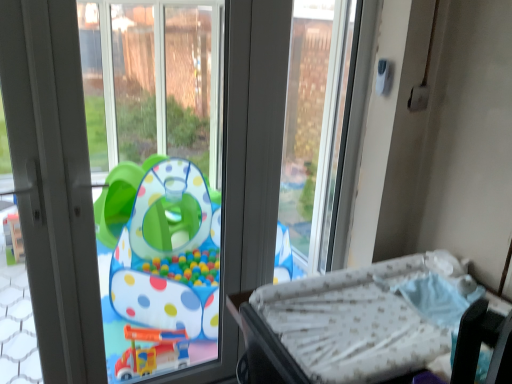
Measure the distance between point (135, 103) and camera.

The distance of point (135, 103) from camera is 4.12 meters.

What do you see at coordinates (49, 171) in the screenshot? I see `white plastic screen door at left` at bounding box center [49, 171].

In order to click on transparent plastic window screen at upper center, which is the second window screen from left to right in this screenshot , I will do `click(314, 123)`.

Which is behind, transparent plastic playpen at center, arranged as the second window screen when viewed from the right, or white plastic screen door at left?

transparent plastic playpen at center, arranged as the second window screen when viewed from the right, is further away from the camera.

Which is closer to the camera, [153,126] or [71,12]?

The point [71,12] is in front.

Is transparent plastic playpen at center, arranged as the second window screen when viewed from the right, far from white plastic screen door at left?

Absolutely, transparent plastic playpen at center, arranged as the second window screen when viewed from the right, is distant from white plastic screen door at left.

Does transparent plastic playpen at center, placed as the 1th window screen when sorted from left to right, have a smaller size compared to white plastic screen door at left?

Incorrect, transparent plastic playpen at center, placed as the 1th window screen when sorted from left to right, is not smaller in size than white plastic screen door at left.

Looking at this image, from the image's perspective, between transparent plastic window screen at upper center, which is the second window screen from left to right, and transparent plastic playpen at center, arranged as the second window screen when viewed from the right, who is located below?

transparent plastic playpen at center, arranged as the second window screen when viewed from the right, from the image's perspective.

Looking at the image, does transparent plastic window screen at upper center, marked as the 1th window screen in a right-to-left arrangement, seem bigger or smaller compared to transparent plastic playpen at center, placed as the 1th window screen when sorted from left to right?

Clearly, transparent plastic window screen at upper center, marked as the 1th window screen in a right-to-left arrangement, is smaller in size than transparent plastic playpen at center, placed as the 1th window screen when sorted from left to right.

Considering their positions, is transparent plastic window screen at upper center, which is the second window screen from left to right, located in front of or behind transparent plastic playpen at center, placed as the 1th window screen when sorted from left to right?

transparent plastic window screen at upper center, which is the second window screen from left to right, is behind transparent plastic playpen at center, placed as the 1th window screen when sorted from left to right.

At what (x,y) coordinates should I click in order to perform the action: click on screen door in front of the transparent plastic playpen at center, arranged as the second window screen when viewed from the right. Please return your answer as a coordinate pair (x, y). Looking at the image, I should click on (49, 171).

Between white plastic screen door at left and transparent plastic playpen at center, placed as the 1th window screen when sorted from left to right, which one is positioned behind?

Positioned behind is transparent plastic playpen at center, placed as the 1th window screen when sorted from left to right.

Which is closer to the camera, (10, 78) or (199, 3)?

Positioned in front is point (10, 78).

From the image's perspective, is white plastic screen door at left below transparent plastic playpen at center, arranged as the second window screen when viewed from the right?

No.

Could you tell me if white dotted mattress at lower right is facing transparent plastic playpen at center, placed as the 1th window screen when sorted from left to right?

No, white dotted mattress at lower right is not aimed at transparent plastic playpen at center, placed as the 1th window screen when sorted from left to right.

Would you say white dotted mattress at lower right is outside transparent plastic playpen at center, placed as the 1th window screen when sorted from left to right?

Yes, white dotted mattress at lower right is located beyond the bounds of transparent plastic playpen at center, placed as the 1th window screen when sorted from left to right.

Can you tell me how much white dotted mattress at lower right and transparent plastic playpen at center, arranged as the second window screen when viewed from the right, differ in facing direction?

white dotted mattress at lower right and transparent plastic playpen at center, arranged as the second window screen when viewed from the right, are facing 88.5 degrees away from each other.

You are a GUI agent. You are given a task and a screenshot of the screen. Output one action in this format:
    pyautogui.click(x=<x>, y=<y>)
    Task: Click on the 1st window screen positioned above the white dotted mattress at lower right (from a real-world perspective)
    Image resolution: width=512 pixels, height=384 pixels.
    Given the screenshot: What is the action you would take?
    pyautogui.click(x=156, y=178)

From the image's perspective, which is above, white plastic screen door at left or transparent plastic window screen at upper center, which is the second window screen from left to right?

transparent plastic window screen at upper center, which is the second window screen from left to right.

Which of these two, white plastic screen door at left or transparent plastic window screen at upper center, marked as the 1th window screen in a right-to-left arrangement, stands taller?

white plastic screen door at left.

Based on the photo, from a real-world perspective, is white plastic screen door at left below transparent plastic window screen at upper center, which is the second window screen from left to right?

Correct, in the physical world, white plastic screen door at left is lower than transparent plastic window screen at upper center, which is the second window screen from left to right.

Is white plastic screen door at left next to transparent plastic window screen at upper center, marked as the 1th window screen in a right-to-left arrangement, and touching it?

No, white plastic screen door at left is not next to transparent plastic window screen at upper center, marked as the 1th window screen in a right-to-left arrangement.

Considering the relative sizes of transparent plastic window screen at upper center, marked as the 1th window screen in a right-to-left arrangement, and white plastic screen door at left in the image provided, is transparent plastic window screen at upper center, marked as the 1th window screen in a right-to-left arrangement, bigger than white plastic screen door at left?

Actually, transparent plastic window screen at upper center, marked as the 1th window screen in a right-to-left arrangement, might be smaller than white plastic screen door at left.

Considering the positions of point (300, 157) and point (29, 155), is point (300, 157) closer or farther from the camera than point (29, 155)?

Point (300, 157) appears to be farther away from the viewer than point (29, 155).

From a real-world perspective, which is physically below, transparent plastic window screen at upper center, which is the second window screen from left to right, or white plastic screen door at left?

white plastic screen door at left.

Is transparent plastic playpen at center, placed as the 1th window screen when sorted from left to right, oriented towards transparent plastic window screen at upper center, marked as the 1th window screen in a right-to-left arrangement?

No, transparent plastic playpen at center, placed as the 1th window screen when sorted from left to right, is not oriented towards transparent plastic window screen at upper center, marked as the 1th window screen in a right-to-left arrangement.

Considering the sizes of objects transparent plastic playpen at center, placed as the 1th window screen when sorted from left to right, and transparent plastic window screen at upper center, marked as the 1th window screen in a right-to-left arrangement, in the image provided, who is smaller, transparent plastic playpen at center, placed as the 1th window screen when sorted from left to right, or transparent plastic window screen at upper center, marked as the 1th window screen in a right-to-left arrangement,?

Smaller between the two is transparent plastic window screen at upper center, marked as the 1th window screen in a right-to-left arrangement.

Is transparent plastic playpen at center, arranged as the second window screen when viewed from the right, taller or shorter than transparent plastic window screen at upper center, marked as the 1th window screen in a right-to-left arrangement?

In the image, transparent plastic playpen at center, arranged as the second window screen when viewed from the right, appears to be taller than transparent plastic window screen at upper center, marked as the 1th window screen in a right-to-left arrangement.

Is transparent plastic playpen at center, arranged as the second window screen when viewed from the right, far from transparent plastic window screen at upper center, marked as the 1th window screen in a right-to-left arrangement?

Yes, transparent plastic playpen at center, arranged as the second window screen when viewed from the right, and transparent plastic window screen at upper center, marked as the 1th window screen in a right-to-left arrangement, are located far from each other.

Find the location of a particular element. Image resolution: width=512 pixels, height=384 pixels. screen door located in front of the transparent plastic playpen at center, arranged as the second window screen when viewed from the right is located at coordinates (49, 171).

The height and width of the screenshot is (384, 512). I want to click on window screen below the transparent plastic window screen at upper center, which is the second window screen from left to right (from the image's perspective), so click(156, 178).

When comparing their distances from transparent plastic window screen at upper center, which is the second window screen from left to right, does white dotted mattress at lower right or white plastic screen door at left seem closer?

white dotted mattress at lower right lies closer to transparent plastic window screen at upper center, which is the second window screen from left to right, than the other object.

Looking at the image, which one is located closer to transparent plastic playpen at center, arranged as the second window screen when viewed from the right, white plastic screen door at left or transparent plastic window screen at upper center, marked as the 1th window screen in a right-to-left arrangement?

Based on the image, transparent plastic window screen at upper center, marked as the 1th window screen in a right-to-left arrangement, appears to be nearer to transparent plastic playpen at center, arranged as the second window screen when viewed from the right.

When comparing their distances from transparent plastic playpen at center, placed as the 1th window screen when sorted from left to right, does transparent plastic window screen at upper center, which is the second window screen from left to right, or white dotted mattress at lower right seem further?

white dotted mattress at lower right lies further to transparent plastic playpen at center, placed as the 1th window screen when sorted from left to right, than the other object.

Estimate the real-world distances between objects in this image. Which object is closer to white plastic screen door at left, white dotted mattress at lower right or transparent plastic window screen at upper center, which is the second window screen from left to right?

white dotted mattress at lower right lies closer to white plastic screen door at left than the other object.

Which object lies nearer to the anchor point white dotted mattress at lower right, white plastic screen door at left or transparent plastic playpen at center, arranged as the second window screen when viewed from the right?

Based on the image, white plastic screen door at left appears to be nearer to white dotted mattress at lower right.

When comparing their distances from white dotted mattress at lower right, does transparent plastic playpen at center, placed as the 1th window screen when sorted from left to right, or transparent plastic window screen at upper center, which is the second window screen from left to right, seem closer?

transparent plastic window screen at upper center, which is the second window screen from left to right, lies closer to white dotted mattress at lower right than the other object.

From the image, which object appears to be farther from white dotted mattress at lower right, transparent plastic window screen at upper center, which is the second window screen from left to right, or transparent plastic playpen at center, placed as the 1th window screen when sorted from left to right?

Among the two, transparent plastic playpen at center, placed as the 1th window screen when sorted from left to right, is located further to white dotted mattress at lower right.

Which object lies further to the anchor point transparent plastic window screen at upper center, which is the second window screen from left to right, white plastic screen door at left or white dotted mattress at lower right?

white plastic screen door at left lies further to transparent plastic window screen at upper center, which is the second window screen from left to right, than the other object.

Locate an element on the screen. window screen located between white plastic screen door at left and transparent plastic window screen at upper center, which is the second window screen from left to right, in the left-right direction is located at coordinates (156, 178).

At what (x,y) coordinates should I click in order to perform the action: click on window screen that lies between transparent plastic window screen at upper center, which is the second window screen from left to right, and white dotted mattress at lower right from top to bottom. Please return your answer as a coordinate pair (x, y). This screenshot has height=384, width=512. Looking at the image, I should click on (156, 178).